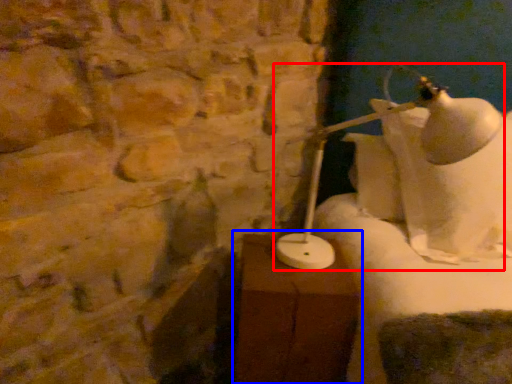
Question: Which object is closer to the camera taking this photo, lamp (highlighted by a red box) or table (highlighted by a blue box)?

Choices:
 (A) lamp
 (B) table

Answer: (B)